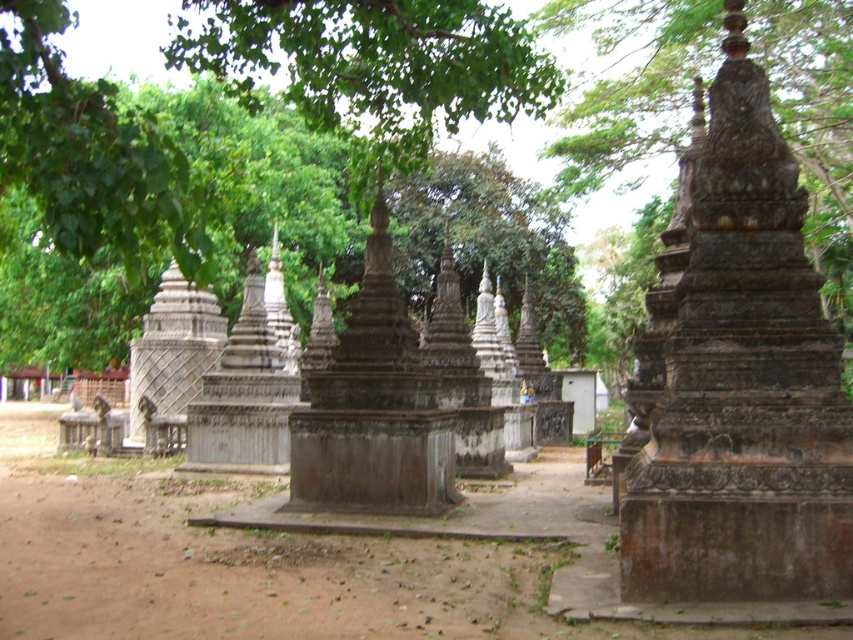
You are a tourist standing on the dirt path near the gray stone stupa at center and the brown dirt field at center. You want to take a photo that captures both objects in the frame. Which object should you position closer to the edge of the frame to ensure both fit?

Since the gray stone stupa at center is narrower than the brown dirt field at center, you should position the brown dirt field at center closer to the edge of the frame to ensure both fit in the photo.

You are standing on the dirt path and want to walk directly to the gray stone stupa at center. Which direction should you move relative to the brown dirt field at center?

The gray stone stupa at center is closer to you than the brown dirt field at center, so you should move towards the gray stone stupa at center directly ahead, as it is in front of the brown dirt field at center.